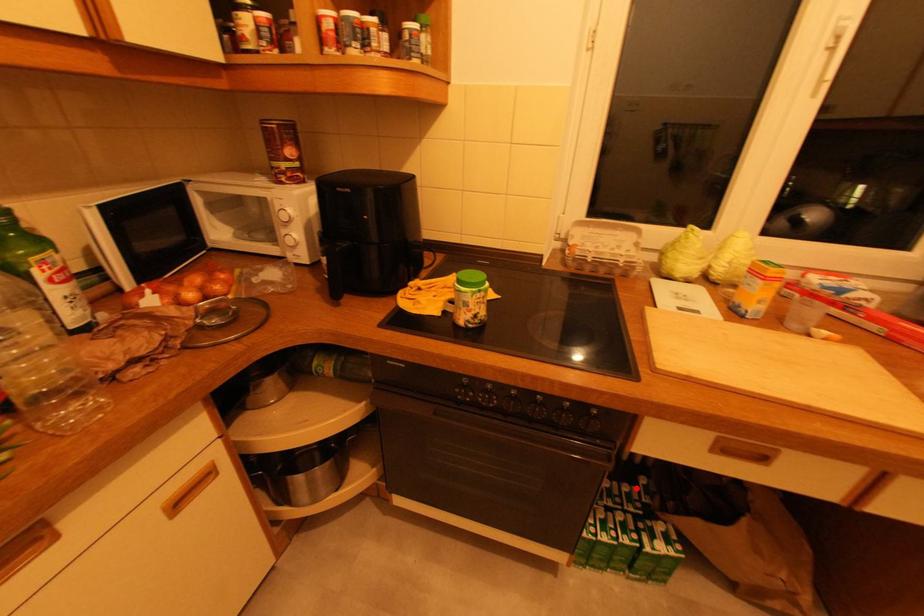
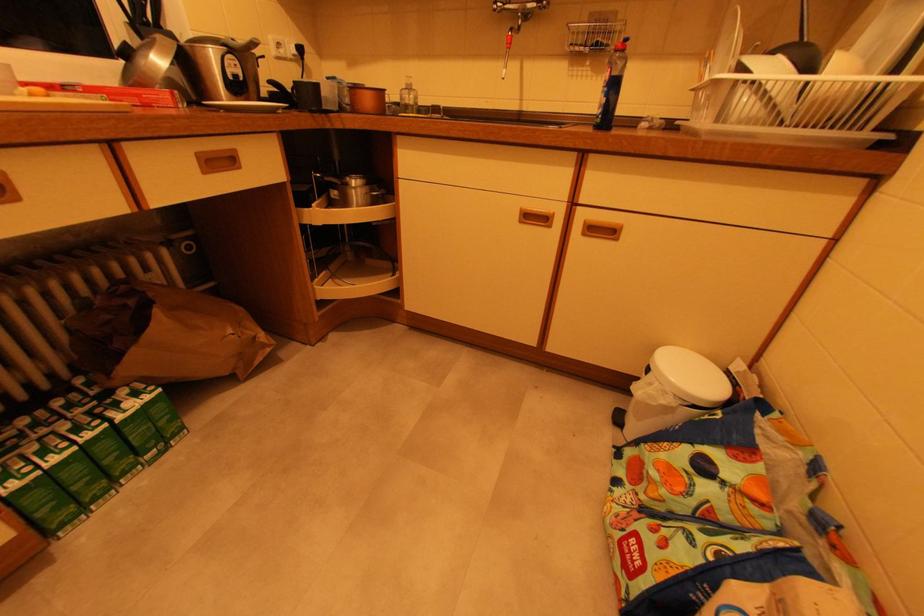
Question: I am providing you with two images of the same scene from different viewpoints. A red point is marked on the first image. At the location where the point appears in image 1, is it still visible in image 2?

Choices:
 (A) Yes
 (B) No

Answer: (A)